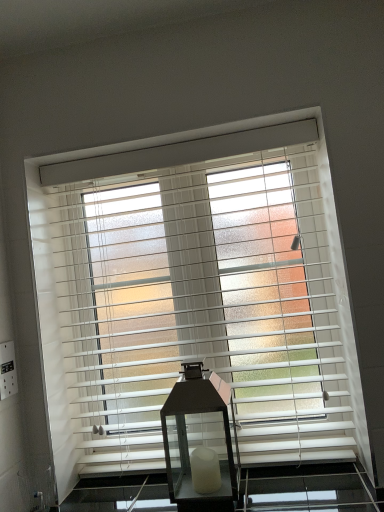
Find the location of `white matte blinds at center`. white matte blinds at center is located at coordinates (202, 293).

Measure the distance between point (x=109, y=466) and camera.

The depth of point (x=109, y=466) is 1.30 meters.

This screenshot has height=512, width=384. Describe the element at coordinates (202, 293) in the screenshot. I see `white matte blinds at center` at that location.

The height and width of the screenshot is (512, 384). What do you see at coordinates (200, 438) in the screenshot? I see `matte black lantern at center` at bounding box center [200, 438].

The width and height of the screenshot is (384, 512). What are the coordinates of `matte black lantern at center` in the screenshot? It's located at (200, 438).

The image size is (384, 512). What are the coordinates of `white matte blinds at center` in the screenshot? It's located at (202, 293).

Considering the positions of objects matte black lantern at center and white matte blinds at center in the image provided, who is more to the left, matte black lantern at center or white matte blinds at center?

From the viewer's perspective, white matte blinds at center appears more on the left side.

Between matte black lantern at center and white matte blinds at center, which one is positioned in front?

matte black lantern at center.

Is point (181, 391) closer or farther from the camera than point (247, 383)?

Point (181, 391).

From the image's perspective, which one is positioned lower, matte black lantern at center or white matte blinds at center?

From the image's view, matte black lantern at center is below.

From a real-world perspective, is matte black lantern at center under white matte blinds at center?

Yes, from a real-world perspective, matte black lantern at center is beneath white matte blinds at center.

Which object is thinner, matte black lantern at center or white matte blinds at center?

white matte blinds at center.

Is matte black lantern at center taller than white matte blinds at center?

No.

Who is smaller, matte black lantern at center or white matte blinds at center?

With smaller size is matte black lantern at center.

Is matte black lantern at center surrounding white matte blinds at center?

That's incorrect, white matte blinds at center is not inside matte black lantern at center.

Based on the photo, is matte black lantern at center far from white matte blinds at center?

No, matte black lantern at center is not far from white matte blinds at center.

Is matte black lantern at center facing away from white matte blinds at center?

That's right, matte black lantern at center is facing away from white matte blinds at center.

Can you tell me how much matte black lantern at center and white matte blinds at center differ in facing direction?

The angular difference between matte black lantern at center and white matte blinds at center is 0.644 degrees.

Locate an element on the screen. window blind located on the left of matte black lantern at center is located at coordinates (202, 293).

From the picture: Which is more to the left, white matte blinds at center or matte black lantern at center?

From the viewer's perspective, white matte blinds at center appears more on the left side.

Between white matte blinds at center and matte black lantern at center, which one is positioned in front?

matte black lantern at center is closer to the camera.

Does point (237, 414) come closer to viewer compared to point (213, 417)?

Yes, it is.

From the image's perspective, relative to matte black lantern at center, is white matte blinds at center above or below?

white matte blinds at center is above matte black lantern at center.

From a real-world perspective, which object rests below the other?

matte black lantern at center.

Looking at their sizes, would you say white matte blinds at center is wider or thinner than matte black lantern at center?

white matte blinds at center is thinner than matte black lantern at center.

Who is taller, white matte blinds at center or matte black lantern at center?

white matte blinds at center is taller.

Is white matte blinds at center bigger or smaller than matte black lantern at center?

white matte blinds at center is bigger than matte black lantern at center.

Is white matte blinds at center completely or partially outside of matte black lantern at center?

Yes.

Is white matte blinds at center touching matte black lantern at center?

No, white matte blinds at center is not in contact with matte black lantern at center.

Is matte black lantern at center at the back of white matte blinds at center?

Yes.

How many degrees apart are the facing directions of white matte blinds at center and matte black lantern at center?

They differ by 0.644 degrees in their facing directions.

How much distance is there between white matte blinds at center and matte black lantern at center?

white matte blinds at center and matte black lantern at center are 27.50 centimeters apart from each other.

Where is `table lamp below the white matte blinds at center (from a real-world perspective)`? The height and width of the screenshot is (512, 384). table lamp below the white matte blinds at center (from a real-world perspective) is located at coordinates click(x=200, y=438).

Find the location of a particular element. The image size is (384, 512). table lamp that appears on the right of white matte blinds at center is located at coordinates (200, 438).

This screenshot has width=384, height=512. I want to click on table lamp lying below the white matte blinds at center (from the image's perspective), so click(x=200, y=438).